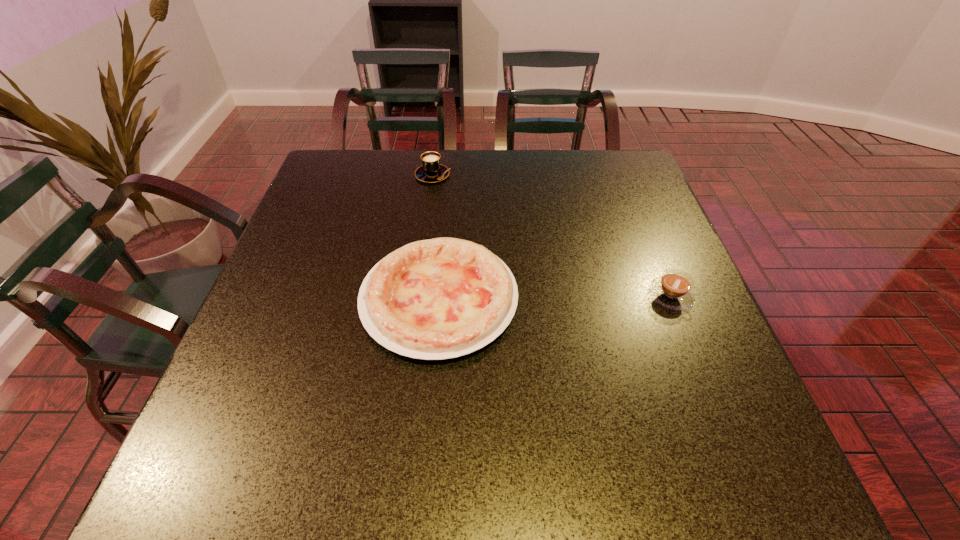
At what (x,y) coordinates should I click in order to perform the action: click on empty space that is in between the nearer cappuccino and the farthest object. Please return your answer as a coordinate pair (x, y). The image size is (960, 540). Looking at the image, I should click on (552, 235).

Locate an element on the screen. The width and height of the screenshot is (960, 540). blank region between the farther cappuccino and the rightmost object is located at coordinates (552, 235).

I want to click on empty space that is in between the shorter cappuccino and the farther cappuccino, so click(x=552, y=235).

In order to click on free space between the pizza and the right cappuccino in this screenshot , I will do `click(555, 298)`.

What are the coordinates of `vacant space that is in between the left cappuccino and the nearer cappuccino` in the screenshot? It's located at (552, 235).

Find the location of a particular element. free space between the farthest object and the pizza is located at coordinates (436, 237).

Locate which object is the second closest to the nearer cappuccino. Please provide its 2D coordinates. Your answer should be formatted as a tuple, i.e. [(x, y)], where the tuple contains the x and y coordinates of a point satisfying the conditions above.

[(431, 171)]

Identify which object is the closest to the rightmost object. Please provide its 2D coordinates. Your answer should be formatted as a tuple, i.e. [(x, y)], where the tuple contains the x and y coordinates of a point satisfying the conditions above.

[(441, 298)]